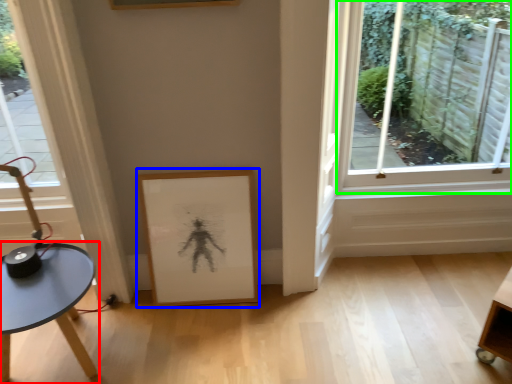
Question: Considering the real-world distances, which object is closest to table (highlighted by a red box)? picture frame (highlighted by a blue box) or window (highlighted by a green box).

Choices:
 (A) picture frame
 (B) window

Answer: (A)